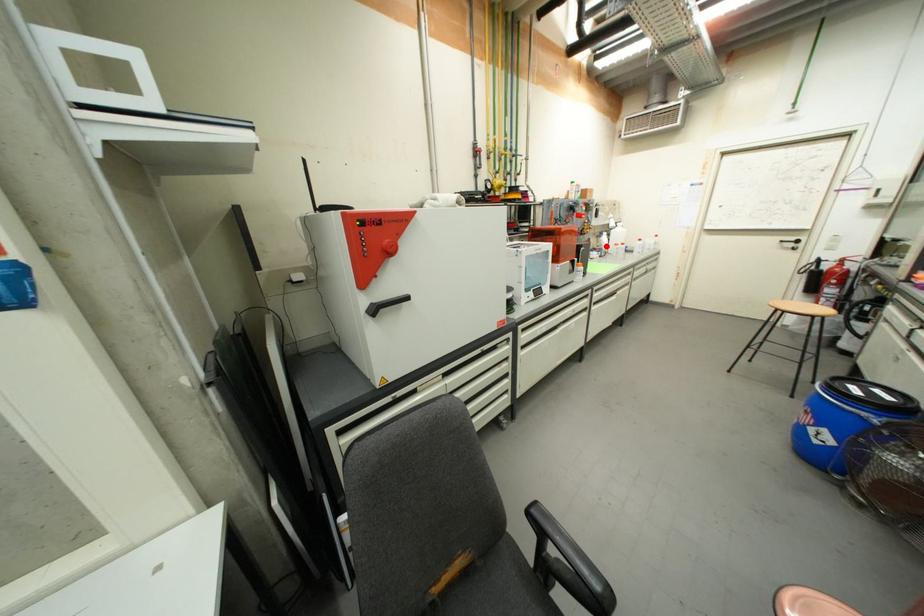
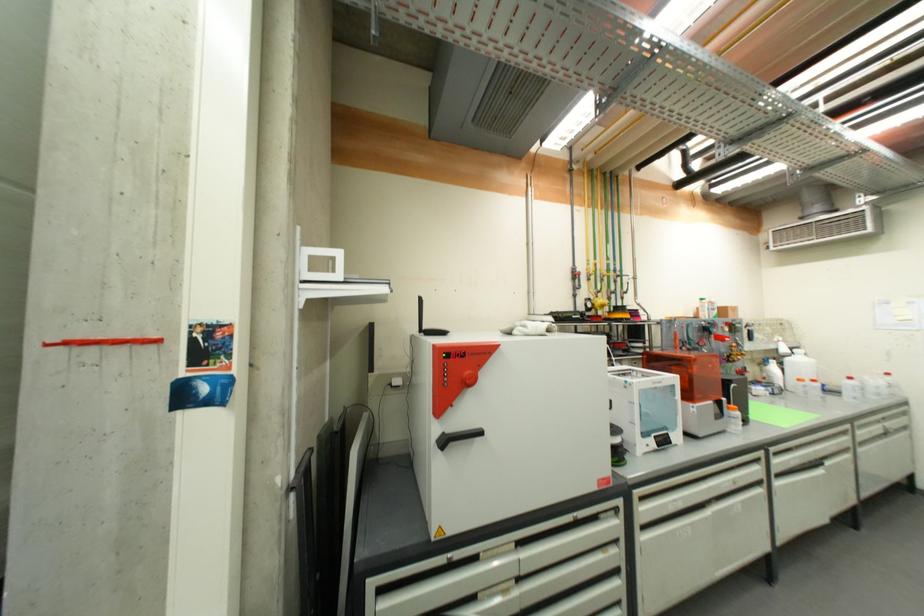
The point at the highlighted location is marked in the first image. Where is the corresponding point in the second image?

(774, 378)